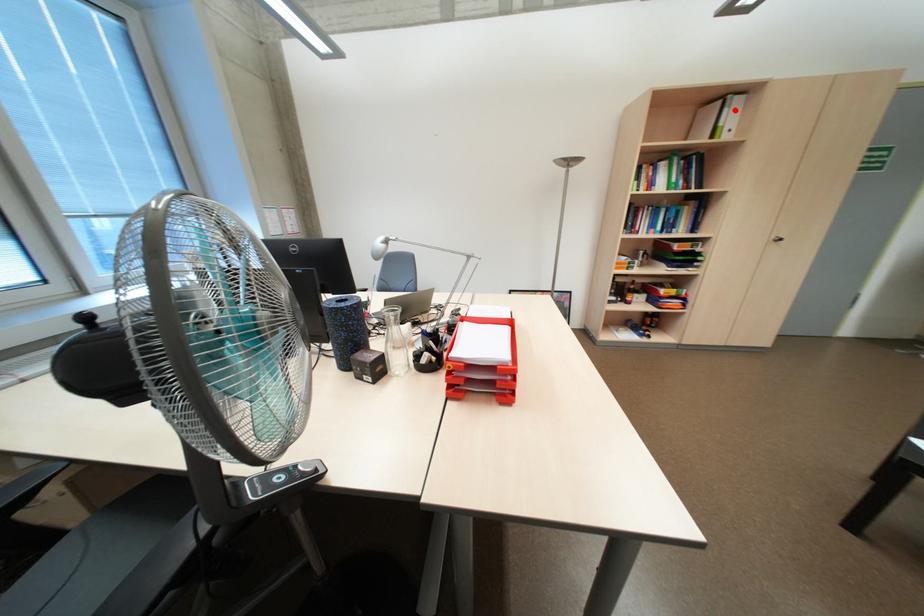
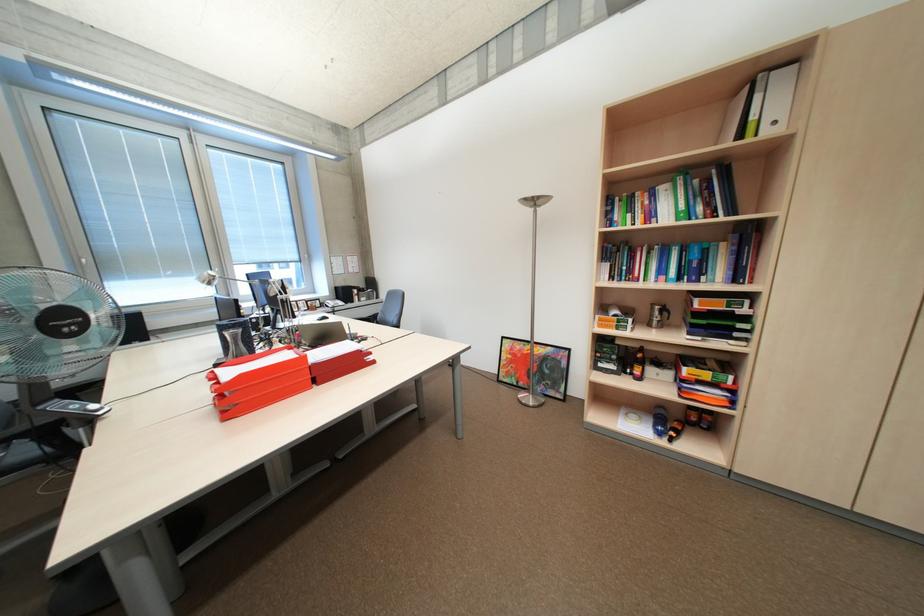
Find the pixel in the second image that matches the highlighted location in the first image.

(768, 97)